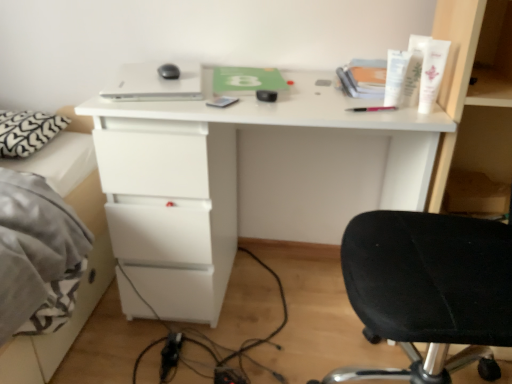
The height and width of the screenshot is (384, 512). Identify the location of free space that is to the left of matte gray notepad at center. (169, 104).